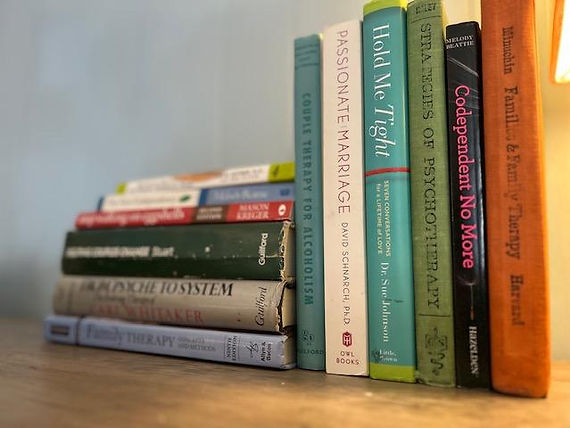
You are a GUI agent. You are given a task and a screenshot of the screen. Output one action in this format:
    pyautogui.click(x=<x>, y=<y>)
    Task: Click on the books laying down
    
    Given the screenshot: What is the action you would take?
    pyautogui.click(x=184, y=341), pyautogui.click(x=193, y=303), pyautogui.click(x=206, y=252), pyautogui.click(x=211, y=220), pyautogui.click(x=214, y=194), pyautogui.click(x=223, y=179)